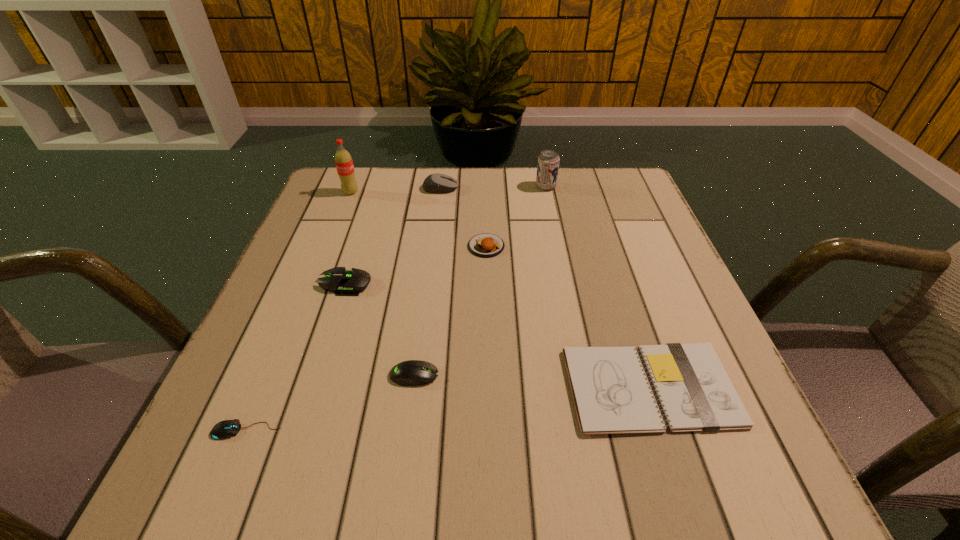
The image size is (960, 540). In order to click on computer equipment that is positioned at the far edge in this screenshot , I will do `click(435, 183)`.

You are a GUI agent. You are given a task and a screenshot of the screen. Output one action in this format:
    pyautogui.click(x=<x>, y=<y>)
    Task: Click on the notepad that is positioned at the near edge
    
    Given the screenshot: What is the action you would take?
    pyautogui.click(x=611, y=392)

Find the location of a particular element. The image size is (960, 540). mouse that is at the near edge is located at coordinates (228, 428).

The width and height of the screenshot is (960, 540). What are the coordinates of `soda at the left edge` in the screenshot? It's located at pos(344,164).

You are a GUI agent. You are given a task and a screenshot of the screen. Output one action in this format:
    pyautogui.click(x=<x>, y=<y>)
    Task: Click on the object located in the right edge section of the desktop
    This screenshot has height=540, width=960.
    Given the screenshot: What is the action you would take?
    tap(611, 392)

Where is `object situated at the far left corner`? The width and height of the screenshot is (960, 540). object situated at the far left corner is located at coordinates (344, 164).

This screenshot has width=960, height=540. Identify the location of object located in the near left corner section of the desktop. (228, 428).

At what (x,y) coordinates should I click in order to perform the action: click on object that is at the near right corner. Please return your answer as a coordinate pair (x, y). Looking at the image, I should click on click(611, 392).

This screenshot has height=540, width=960. In the image, there is a desktop. In order to click on vacant space at the far edge in this screenshot , I will do `click(425, 197)`.

The image size is (960, 540). In the image, there is a desktop. What are the coordinates of `vacant area at the near edge` in the screenshot? It's located at (540, 476).